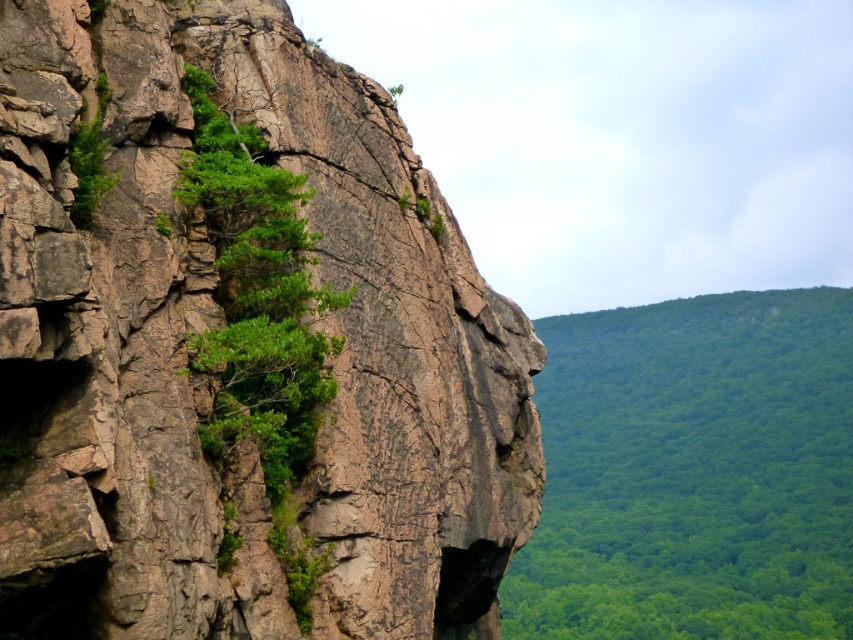
Is rusty brown rock at center taller than green leafy tree at right?

No.

From the picture: Can you confirm if rusty brown rock at center is smaller than green leafy tree at right?

Correct, rusty brown rock at center occupies less space than green leafy tree at right.

Is point (15, 227) positioned in front of point (828, 564)?

Yes, point (15, 227) is closer to viewer.

Identify the location of rusty brown rock at center. (241, 346).

Who is more distant from viewer, (646, 416) or (306, 396)?

The point (646, 416) is behind.

Who is more forward, (720, 513) or (231, 124)?

Positioned in front is point (231, 124).

Is point (677, 394) less distant than point (318, 294)?

No, (677, 394) is behind (318, 294).

Locate an element on the screen. The width and height of the screenshot is (853, 640). green leafy tree at right is located at coordinates (693, 472).

Is rusty brown rock at center positioned at the back of green leafy tree at upper left?

No, rusty brown rock at center is closer to the viewer.

Is point (482, 605) positioned behind point (291, 252)?

Yes, it is behind point (291, 252).

Locate an element on the screen. The width and height of the screenshot is (853, 640). rusty brown rock at center is located at coordinates (241, 346).